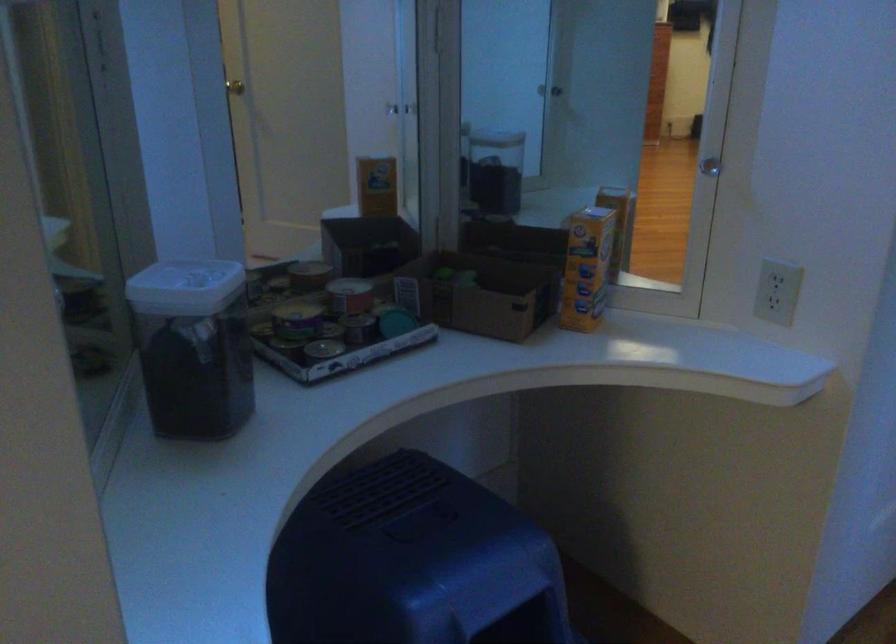
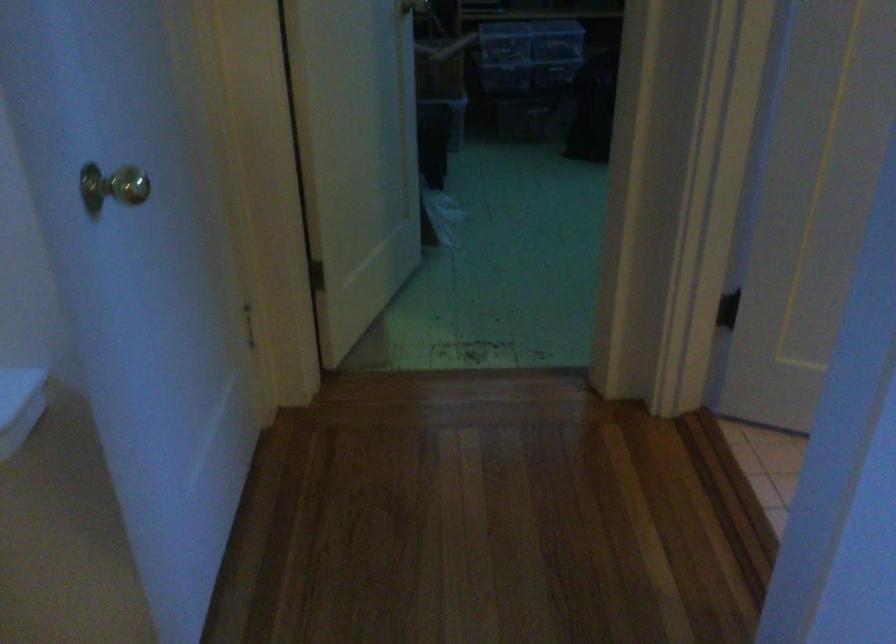
Based on the continuous images, in which direction is the camera rotating?

The rotation direction of the camera is right-down.